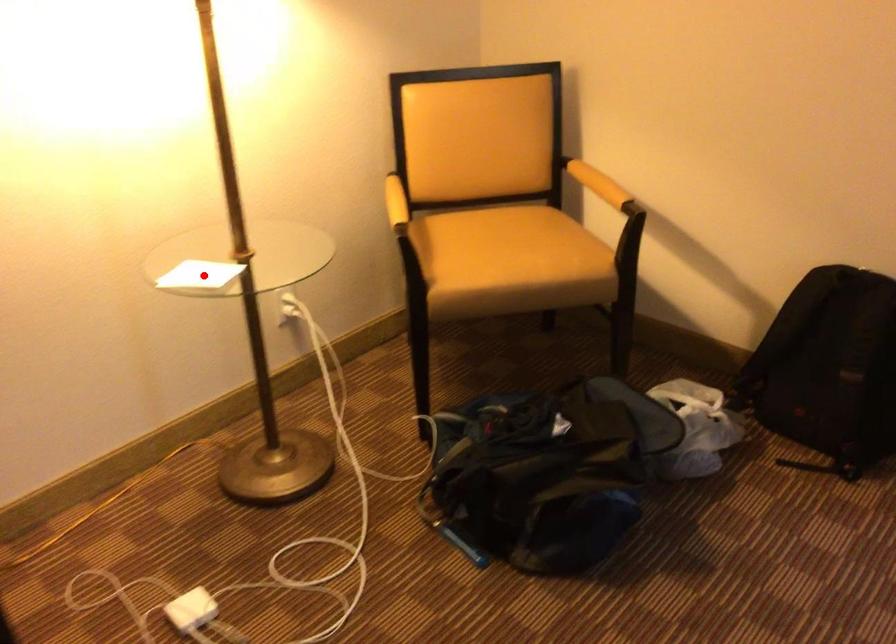
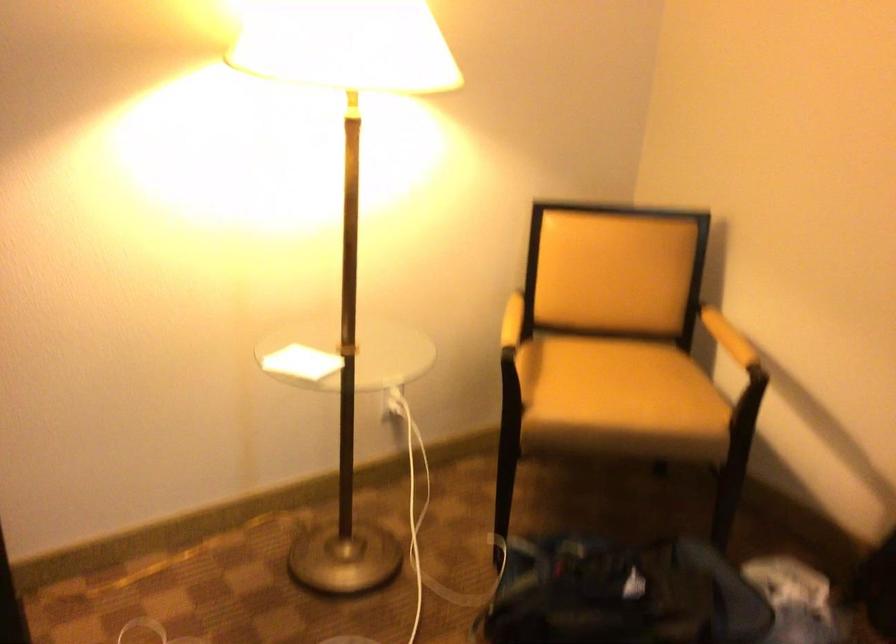
In the second image, find the point that corresponds to the highlighted location in the first image.

(300, 363)